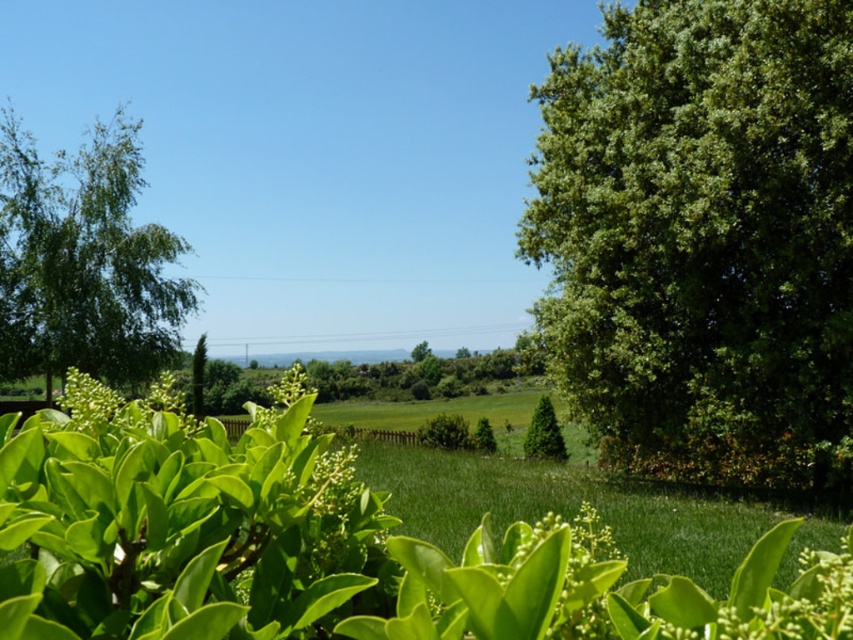
Which of these two, green leafy tree at right or green leafy bush at center, stands shorter?

green leafy bush at center

Measure the distance from green leafy tree at right to green leafy bush at center.

green leafy tree at right is 10.94 meters from green leafy bush at center.

Between point (840, 484) and point (479, 426), which one is positioned behind?

The point (479, 426) is behind.

Identify the location of green leafy tree at right. The width and height of the screenshot is (853, 640). coord(701,237).

In the scene shown: Who is taller, green leafy tree at right or green matte evergreen tree at center?

green leafy tree at right is taller.

Does green leafy tree at right have a lesser height compared to green matte evergreen tree at center?

In fact, green leafy tree at right may be taller than green matte evergreen tree at center.

The image size is (853, 640). I want to click on green leafy tree at right, so click(x=701, y=237).

Is point (543, 440) closer to camera compared to point (477, 433)?

Yes, point (543, 440) is in front of point (477, 433).

Does green matte evergreen tree at center appear on the right side of green leafy bush at center?

Yes, green matte evergreen tree at center is to the right of green leafy bush at center.

Locate an element on the screen. This screenshot has width=853, height=640. green matte evergreen tree at center is located at coordinates (544, 433).